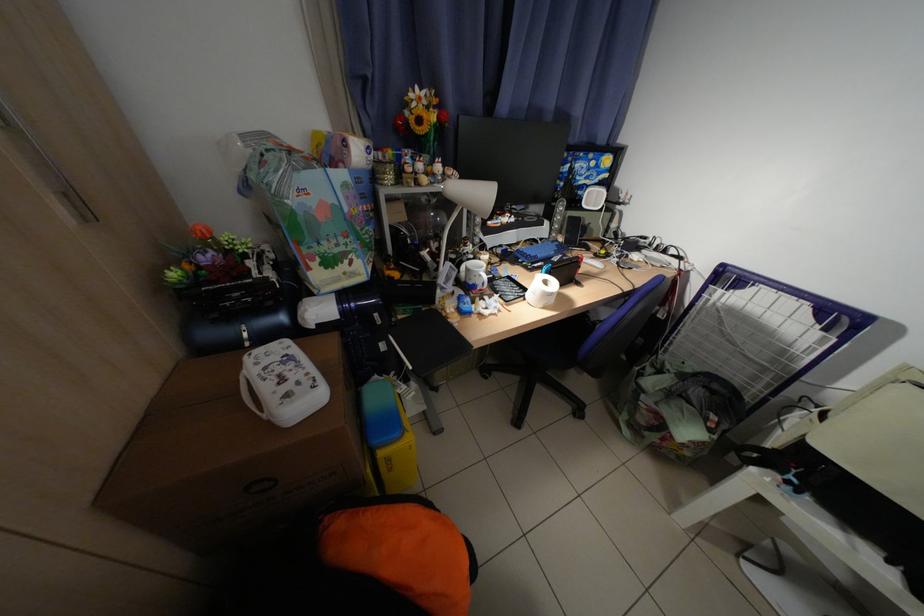
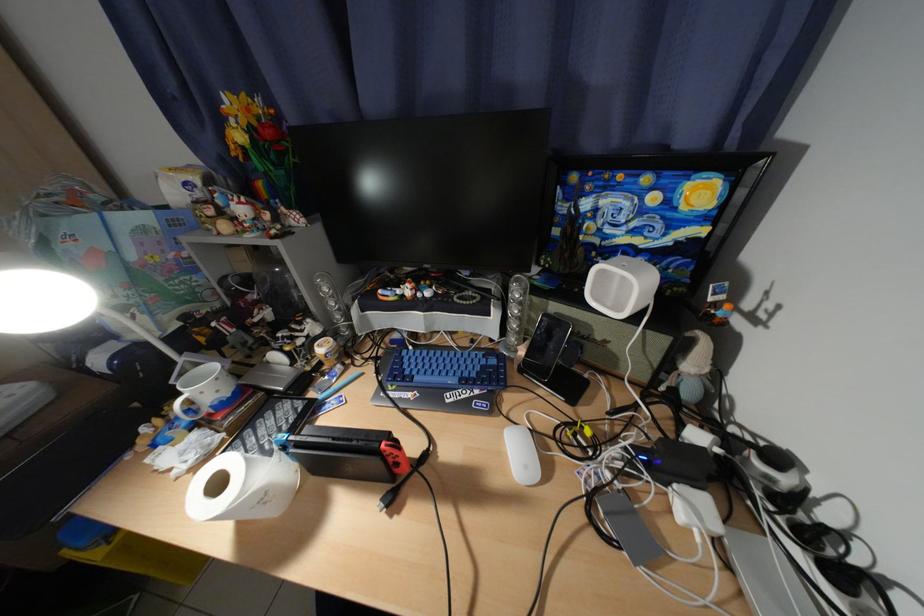
The point at (x=626, y=225) is marked in the first image. Where is the corresponding point in the second image?

(704, 367)